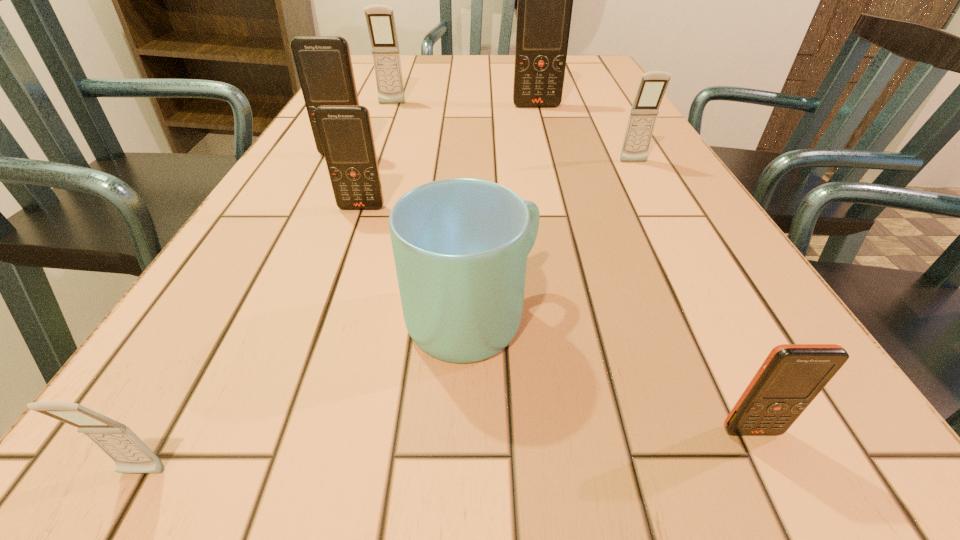
Find the location of a particular element. Image resolution: width=960 pixels, height=540 pixels. the fourth object from right to left is located at coordinates (460, 245).

At what (x,y) coordinates should I click in order to perform the action: click on the sixth farthest object. Please return your answer as a coordinate pair (x, y). This screenshot has width=960, height=540. Looking at the image, I should click on (460, 245).

The width and height of the screenshot is (960, 540). Identify the location of the smallest orange cellular telephone. (792, 375).

Identify the location of the second nearest cellular telephone. (792, 375).

Find the location of a particular element. This screenshot has height=540, width=960. the leftmost gray cellular telephone is located at coordinates (131, 455).

Find the location of `the nearest cellular telephone`. the nearest cellular telephone is located at coordinates (131, 455).

The width and height of the screenshot is (960, 540). I want to click on vacant area located 0.340m on the screen of the third cellular telephone from right to left, so click(x=554, y=176).

This screenshot has height=540, width=960. Find the location of `vacant region located 0.230m on the front-facing side of the farthest gray cellular telephone`. vacant region located 0.230m on the front-facing side of the farthest gray cellular telephone is located at coordinates (375, 147).

Find the location of a particular element. vacant space located 0.260m on the screen of the second biggest orange cellular telephone is located at coordinates (305, 231).

Identify the location of vacant point located on the front-facing side of the second smallest gray cellular telephone. (662, 215).